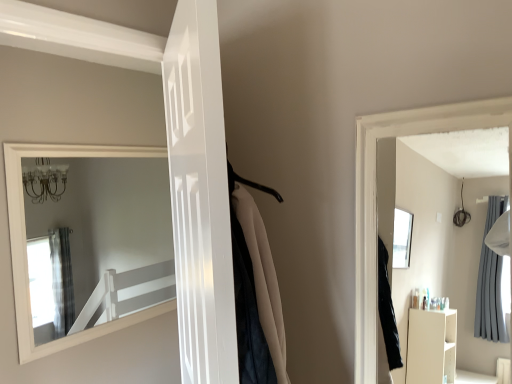
Question: Does white glossy door at center, which ranks as the 2th door in left-to-right order, lie in front of white glossy door at upper left, the 2th door positioned from the right?

Choices:
 (A) yes
 (B) no

Answer: (A)

Question: Could you tell me if white glossy door at center, which ranks as the 2th door in left-to-right order, is turned towards white glossy door at upper left, the 1th door viewed from the left?

Choices:
 (A) no
 (B) yes

Answer: (B)

Question: From the image's perspective, is white glossy door at center, which ranks as the 2th door in left-to-right order, above white glossy door at upper left, the 1th door viewed from the left?

Choices:
 (A) no
 (B) yes

Answer: (A)

Question: From a real-world perspective, is white glossy door at center, which ranks as the 2th door in left-to-right order, on top of white glossy door at upper left, the 1th door viewed from the left?

Choices:
 (A) yes
 (B) no

Answer: (B)

Question: Are white glossy door at center, which ranks as the 2th door in left-to-right order, and white glossy door at upper left, the 2th door positioned from the right, making contact?

Choices:
 (A) no
 (B) yes

Answer: (A)

Question: Can you confirm if white glossy door at center, which ranks as the 2th door in left-to-right order, is thinner than white glossy door at upper left, the 1th door viewed from the left?

Choices:
 (A) no
 (B) yes

Answer: (A)

Question: From a real-world perspective, is white glossy door at upper left, the 2th door positioned from the right, over white glossy door at center, which ranks as the 2th door in left-to-right order?

Choices:
 (A) no
 (B) yes

Answer: (B)

Question: Can you confirm if white glossy door at upper left, the 1th door viewed from the left, is bigger than white glossy door at center, which ranks as the 2th door in left-to-right order?

Choices:
 (A) yes
 (B) no

Answer: (B)

Question: Considering the relative positions of white glossy door at upper left, the 2th door positioned from the right, and white glossy door at center, which ranks as the first door in right-to-left order, in the image provided, is white glossy door at upper left, the 2th door positioned from the right, to the left of white glossy door at center, which ranks as the first door in right-to-left order, from the viewer's perspective?

Choices:
 (A) yes
 (B) no

Answer: (A)

Question: From the image's perspective, is white glossy door at upper left, the 1th door viewed from the left, on white glossy door at center, which ranks as the 2th door in left-to-right order?

Choices:
 (A) no
 (B) yes

Answer: (B)

Question: Is white glossy door at upper left, the 1th door viewed from the left, in contact with white glossy door at center, which ranks as the 2th door in left-to-right order?

Choices:
 (A) no
 (B) yes

Answer: (A)

Question: Is white glossy door at upper left, the 2th door positioned from the right, taller than white glossy door at center, which ranks as the first door in right-to-left order?

Choices:
 (A) yes
 (B) no

Answer: (A)

Question: Considering the positions of point (219, 49) and point (45, 370), is point (219, 49) closer or farther from the camera than point (45, 370)?

Choices:
 (A) closer
 (B) farther

Answer: (A)